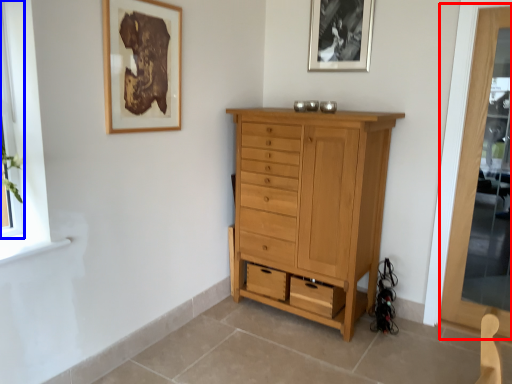
Question: Which of the following is the closest to the observer, screen door (highlighted by a red box) or window (highlighted by a blue box)?

Choices:
 (A) screen door
 (B) window

Answer: (B)